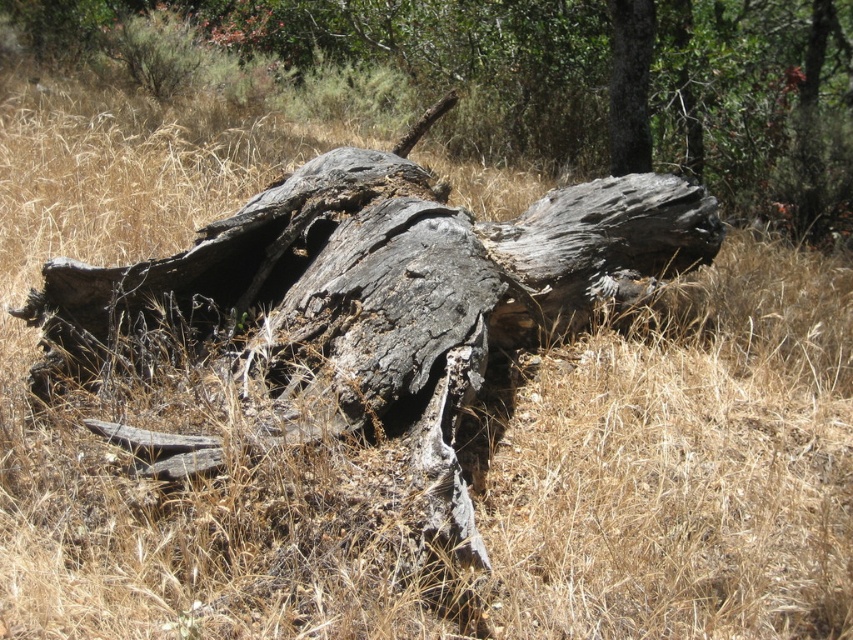
You are a park ranger assessing the area. You see the charred wood log at center and the gray rough bark tree trunk at upper center. Which object has a greater width?

The charred wood log at center has a greater width than the gray rough bark tree trunk at upper center.

Consider the image. You are a firefighter assessing a wildfire risk area. You observe the charred wood log at center and the gray rough bark tree trunk at upper center. Which object is taller in the scene?

The charred wood log at center is much taller than the gray rough bark tree trunk at upper center.